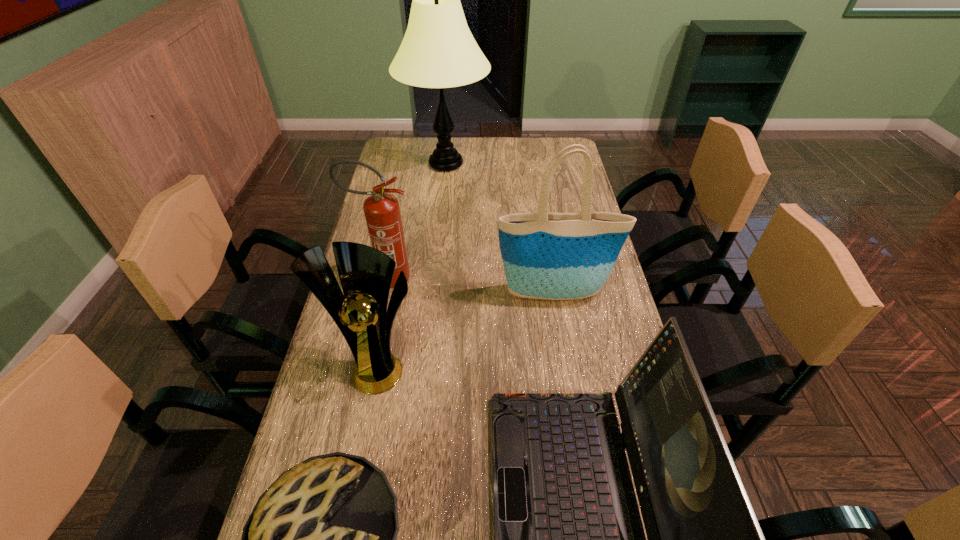
Identify the location of lamp. (438, 50).

I want to click on the farthest object, so click(x=438, y=50).

This screenshot has height=540, width=960. What are the coordinates of `tote bag` in the screenshot? It's located at (556, 256).

Identify the location of fire extinguisher. (382, 213).

Locate an element on the screen. award is located at coordinates (361, 314).

You are a GUI agent. You are given a task and a screenshot of the screen. Output one action in this format:
    pyautogui.click(x=<x>, y=<y>)
    Task: Click on the vacant space located 0.230m on the front of the tallest object
    The width and height of the screenshot is (960, 540).
    Given the screenshot: What is the action you would take?
    pyautogui.click(x=440, y=228)

Locate an element on the screen. The image size is (960, 540). free point located 0.380m on the left of the tote bag is located at coordinates (360, 295).

Identify the location of vacant space situated 0.150m from the nozzle of the fire extinguisher. click(468, 278).

Where is `blank area located 0.140m at the front of the third nearest object, where the globe is visible`? blank area located 0.140m at the front of the third nearest object, where the globe is visible is located at coordinates click(x=360, y=455).

This screenshot has height=540, width=960. I want to click on object that is at the far edge, so click(x=438, y=50).